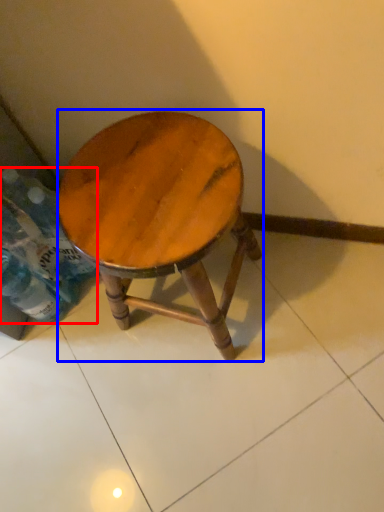
Question: Among these objects, which one is farthest to the camera, bottle (highlighted by a red box) or stool (highlighted by a blue box)?

Choices:
 (A) bottle
 (B) stool

Answer: (A)